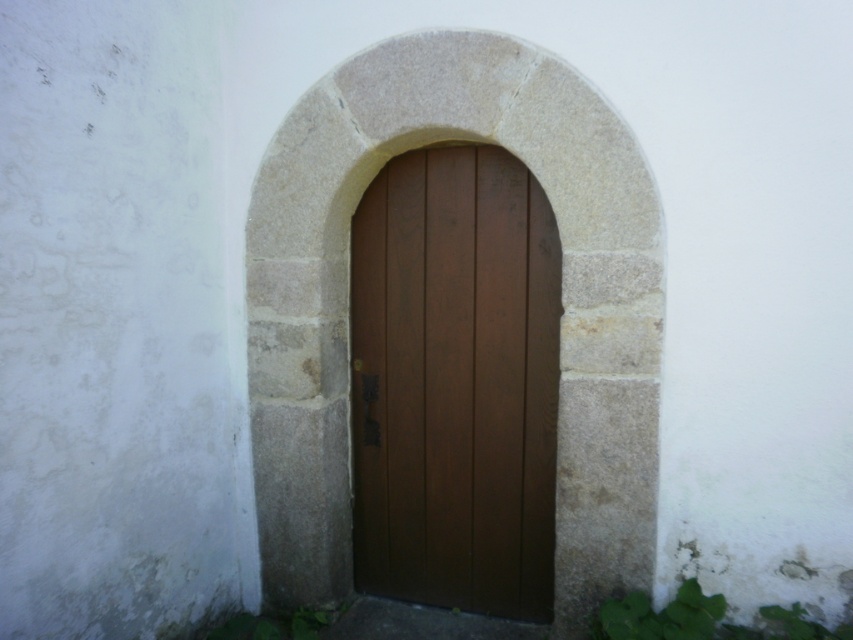
You are a painter who needs to decide which object to paint first between the smooth stone archway at center and the brown wooden door at center. Which one is taller and should be painted first?

The smooth stone archway at center is much taller than the brown wooden door at center, so you should paint the smooth stone archway at center first.

Consider the image. You are a painter who needs to decide whether to use a wide or narrow paintbrush to paint the smooth stone archway at center and the brown wooden door at center. Based on their widths, which paintbrush should you choose for each?

The smooth stone archway at center might be wider than brown wooden door at center, so you should use a wide paintbrush for the smooth stone archway at center and a narrow paintbrush for the brown wooden door at center.

You are an architect designing a new building and want to ensure the entrance matches the historical style of the surrounding area. The entrance must include both the smooth stone archway at center and the brown wooden door at center. Based on the image provided, which element should be larger to maintain the historical aesthetic?

The smooth stone archway at center should be larger than the brown wooden door at center to maintain the historical aesthetic, as the description states that the smooth stone archway at center is bigger than the brown wooden door at center.